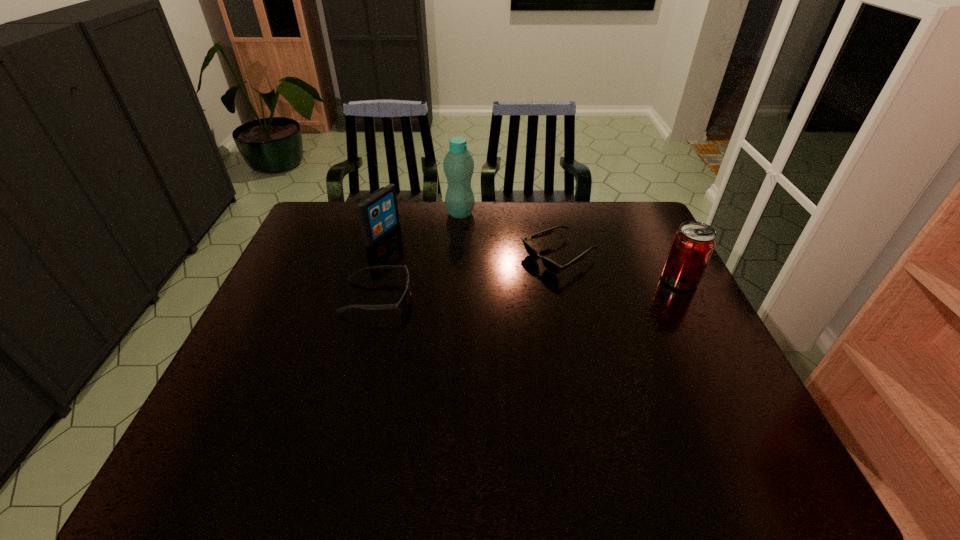
Locate an element on the screen. This screenshot has height=540, width=960. vacant region located on the front-facing side of the right sunglasses is located at coordinates (420, 327).

Locate an element on the screen. The height and width of the screenshot is (540, 960). free space located at the front cap of the third object from right to left is located at coordinates (496, 282).

I want to click on blank space located 0.290m at the front cap of the third object from right to left, so click(492, 271).

The height and width of the screenshot is (540, 960). In order to click on vacant space located at the front cap of the third object from right to left in this screenshot , I will do `click(490, 267)`.

At what (x,y) coordinates should I click in order to perform the action: click on free spot located 0.340m on the front screen of the iPod. Please return your answer as a coordinate pair (x, y). Looking at the image, I should click on (481, 276).

Identify the location of blank space located on the front screen of the iPod. This screenshot has height=540, width=960. (450, 265).

This screenshot has height=540, width=960. I want to click on free point located 0.120m on the front screen of the iPod, so click(422, 253).

Locate an element on the screen. This screenshot has height=540, width=960. sunglasses that is positioned at the far edge is located at coordinates (550, 265).

This screenshot has height=540, width=960. In order to click on water bottle present at the far edge in this screenshot , I will do `click(458, 164)`.

I want to click on iPod at the far edge, so click(x=378, y=214).